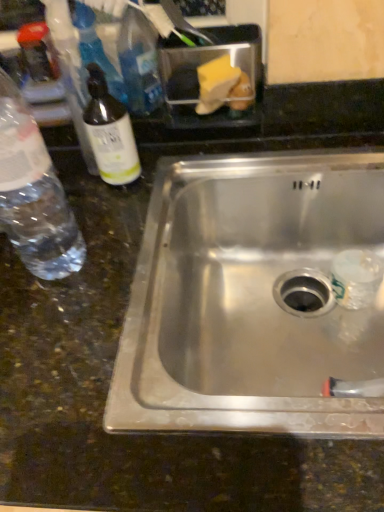
Question: Does clear plastic bottle at left, the first bottle when ordered from left to right, have a lesser width compared to clear glass bottle at left, acting as the second bottle starting from the left?

Choices:
 (A) no
 (B) yes

Answer: (A)

Question: Does clear plastic bottle at left, the first bottle when ordered from left to right, touch clear glass bottle at left, acting as the second bottle starting from the left?

Choices:
 (A) no
 (B) yes

Answer: (A)

Question: From the image's perspective, does clear plastic bottle at left, the first bottle when ordered from left to right, appear lower than clear glass bottle at left, acting as the second bottle starting from the left?

Choices:
 (A) no
 (B) yes

Answer: (B)

Question: Could clear glass bottle at left, which is the 1th bottle in right-to-left order, be considered to be inside clear plastic bottle at left, the first bottle when ordered from left to right?

Choices:
 (A) no
 (B) yes

Answer: (A)

Question: Is clear plastic bottle at left, which is the second bottle in right-to-left order, at the left side of clear glass bottle at left, acting as the second bottle starting from the left?

Choices:
 (A) yes
 (B) no

Answer: (A)

Question: Is there a large distance between clear plastic bottle at left, the first bottle when ordered from left to right, and clear glass bottle at left, which is the 1th bottle in right-to-left order?

Choices:
 (A) no
 (B) yes

Answer: (A)

Question: Is clear glass bottle at left, which is the 1th bottle in right-to-left order, wider than clear plastic bottle at left, which is the second bottle in right-to-left order?

Choices:
 (A) yes
 (B) no

Answer: (B)

Question: Considering the relative sizes of clear glass bottle at left, acting as the second bottle starting from the left, and clear plastic bottle at left, the first bottle when ordered from left to right, in the image provided, is clear glass bottle at left, acting as the second bottle starting from the left, taller than clear plastic bottle at left, the first bottle when ordered from left to right,?

Choices:
 (A) yes
 (B) no

Answer: (B)

Question: Is clear glass bottle at left, which is the 1th bottle in right-to-left order, surrounding clear plastic bottle at left, which is the second bottle in right-to-left order?

Choices:
 (A) no
 (B) yes

Answer: (A)

Question: From the image's perspective, is clear glass bottle at left, which is the 1th bottle in right-to-left order, below clear plastic bottle at left, which is the second bottle in right-to-left order?

Choices:
 (A) no
 (B) yes

Answer: (A)

Question: Is clear glass bottle at left, acting as the second bottle starting from the left, to the left of clear plastic bottle at left, the first bottle when ordered from left to right, from the viewer's perspective?

Choices:
 (A) yes
 (B) no

Answer: (B)

Question: Is the position of clear glass bottle at left, which is the 1th bottle in right-to-left order, less distant than that of clear plastic bottle at left, the first bottle when ordered from left to right?

Choices:
 (A) yes
 (B) no

Answer: (B)

Question: Is clear plastic bottle at left, the first bottle when ordered from left to right, placed right next to stainless steel sink at center?

Choices:
 (A) yes
 (B) no

Answer: (B)